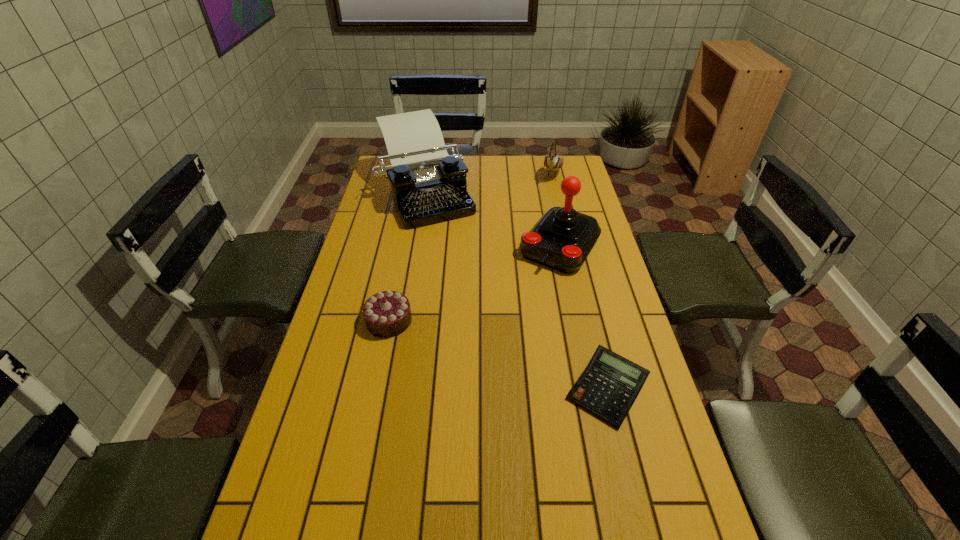
Where is `free space on the desktop that is between the chocolate cake and the calculator and is positioned on the keys of the typewriter`? free space on the desktop that is between the chocolate cake and the calculator and is positioned on the keys of the typewriter is located at coordinates (523, 363).

Identify the location of free space on the desktop that is between the second shortest object and the calculator and is positioned at the face of the bird. (492, 353).

The height and width of the screenshot is (540, 960). Find the location of `vacant space on the desktop that is between the fourth tallest object and the shortest object and is positioned on the base of the joystick`. vacant space on the desktop that is between the fourth tallest object and the shortest object and is positioned on the base of the joystick is located at coordinates (485, 350).